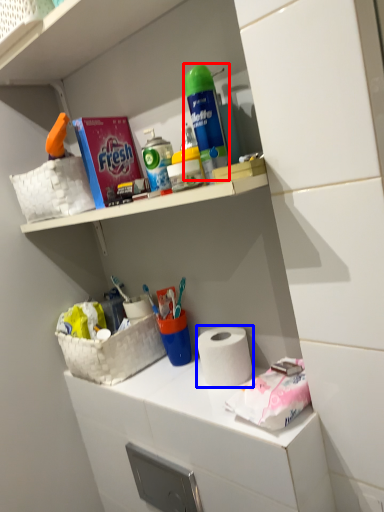
Question: Which object is further to the camera taking this photo, cleaning product (highlighted by a red box) or paper towel (highlighted by a blue box)?

Choices:
 (A) cleaning product
 (B) paper towel

Answer: (B)